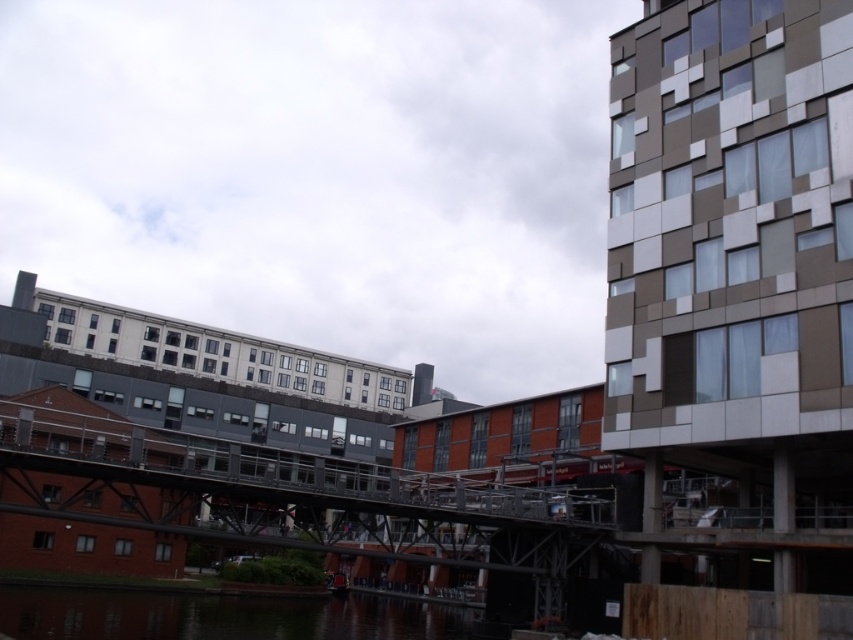
Question: Can you confirm if metallic gray bridge at center is positioned to the left of smooth reflective water at lower center?

Choices:
 (A) no
 (B) yes

Answer: (B)

Question: Which point is farther to the camera?

Choices:
 (A) metallic gray bridge at center
 (B) smooth reflective water at lower center

Answer: (B)

Question: Can you confirm if metallic gray bridge at center is bigger than smooth reflective water at lower center?

Choices:
 (A) yes
 (B) no

Answer: (A)

Question: Which object is farther from the camera taking this photo?

Choices:
 (A) metallic gray bridge at center
 (B) smooth reflective water at lower center

Answer: (B)

Question: Is metallic gray bridge at center wider than smooth reflective water at lower center?

Choices:
 (A) no
 (B) yes

Answer: (B)

Question: Which point is farther to the camera?

Choices:
 (A) (270, 460)
 (B) (44, 596)

Answer: (B)